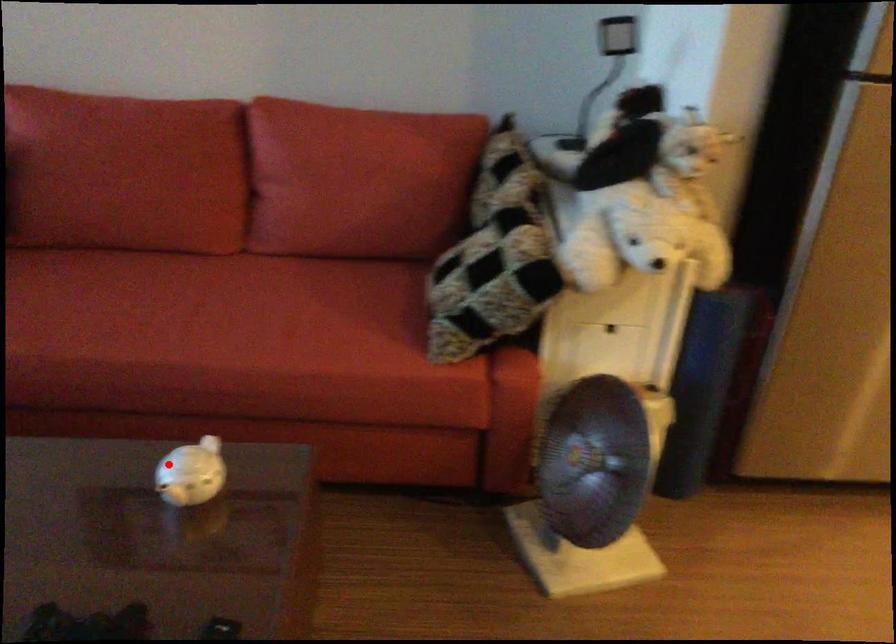
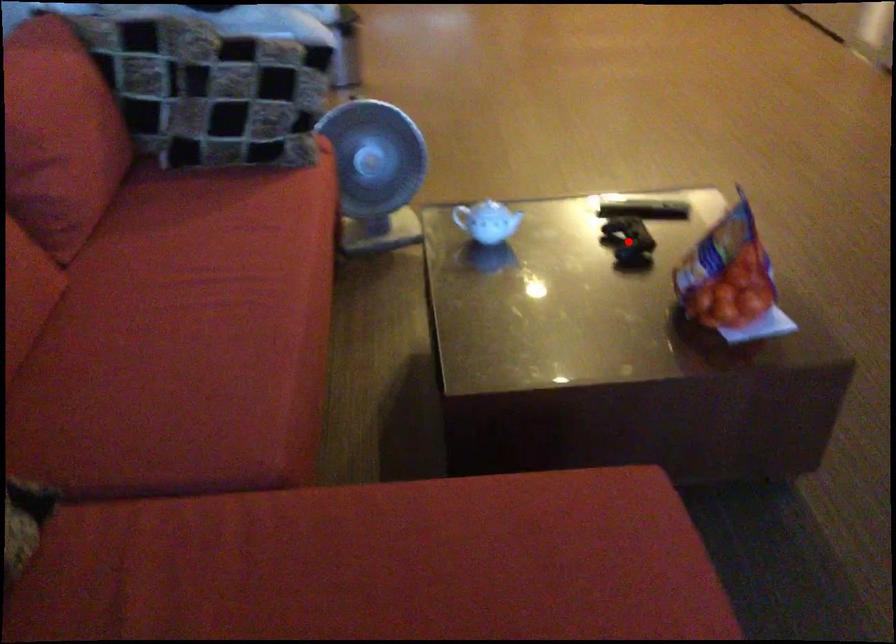
I am providing you with two images of the same scene from different viewpoints. A red point is marked on the first image and another point is marked on the second image. Is the marked point in image1 the same physical position as the marked point in image2?

No